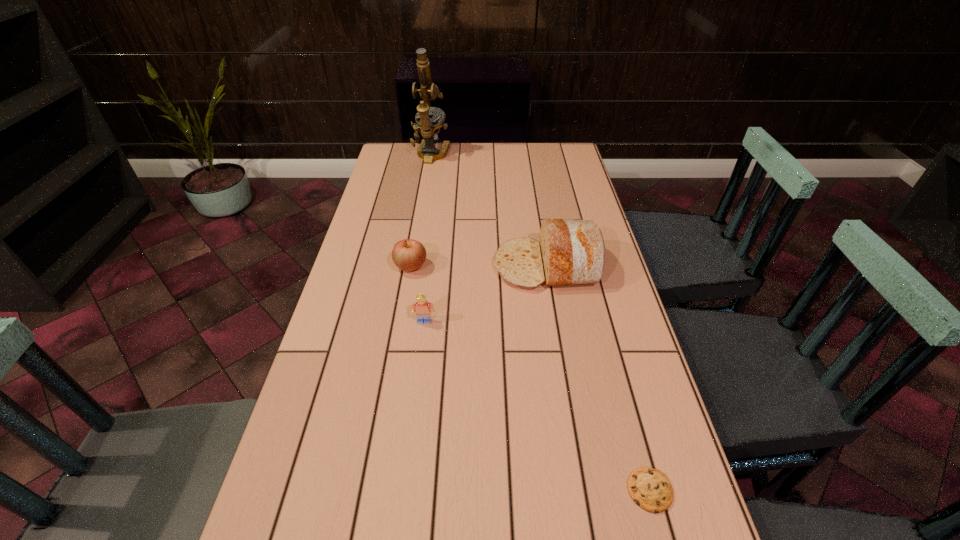
You are a GUI agent. You are given a task and a screenshot of the screen. Output one action in this format:
    pyautogui.click(x=<x>, y=<y>)
    Task: Click on the free space in the image that satisfies the following two spatial constraints: 1. at the sliced end of the fourth shortest object; 2. on the front-facing side of the fourth farthest object
    The width and height of the screenshot is (960, 540).
    Given the screenshot: What is the action you would take?
    pyautogui.click(x=556, y=321)

Find the location of `free space that satisfies the following two spatial constraints: 1. at the sliced end of the bread; 2. on the front-facing side of the Lego`. free space that satisfies the following two spatial constraints: 1. at the sliced end of the bread; 2. on the front-facing side of the Lego is located at coordinates (556, 321).